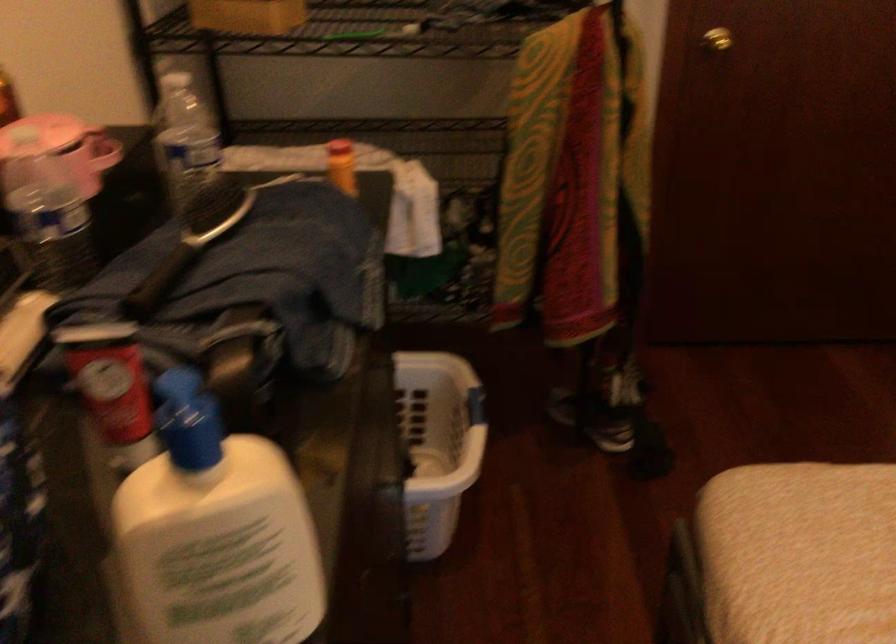
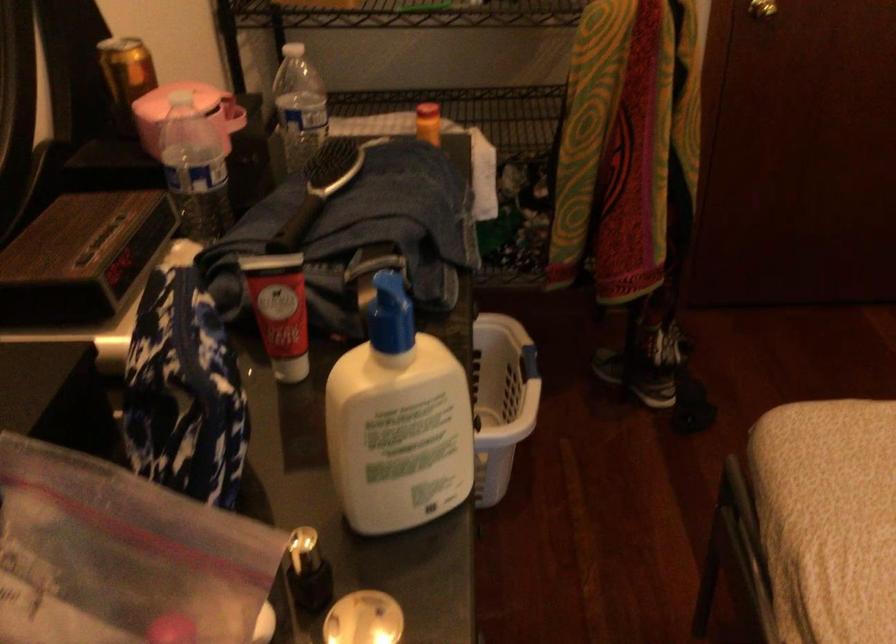
Find the pixel in the second image that matches (x=220, y=205) in the first image.

(337, 164)